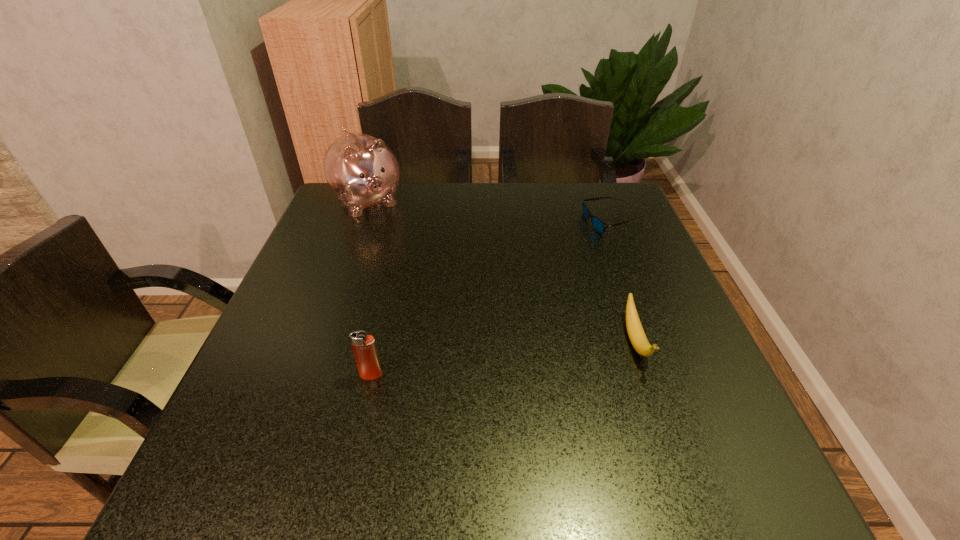
Locate an element on the screen. This screenshot has height=540, width=960. the third shortest object is located at coordinates (364, 348).

Where is `banana`? Image resolution: width=960 pixels, height=540 pixels. banana is located at coordinates (636, 334).

I want to click on the shortest object, so click(599, 225).

Find the location of a particular element. piggy bank is located at coordinates (361, 170).

I want to click on vacant space located on the left of the igniter, so click(293, 375).

The height and width of the screenshot is (540, 960). I want to click on vacant space located 0.050m at the stem of the third tallest object, so click(x=656, y=400).

Identify the location of free space located 0.260m at the front of the shortest object showing the lenses. The width and height of the screenshot is (960, 540). (550, 286).

I want to click on free space located at the front of the shortest object showing the lenses, so click(x=584, y=251).

In order to click on vacant area situated 0.200m at the front of the shortest object showing the lenses in this screenshot , I will do `click(563, 273)`.

You are a GUI agent. You are given a task and a screenshot of the screen. Output one action in this format:
    pyautogui.click(x=<x>, y=<y>)
    Task: Click on the vacant space situated on the front facing side of the tallest object
    This screenshot has height=540, width=960.
    Given the screenshot: What is the action you would take?
    click(397, 241)